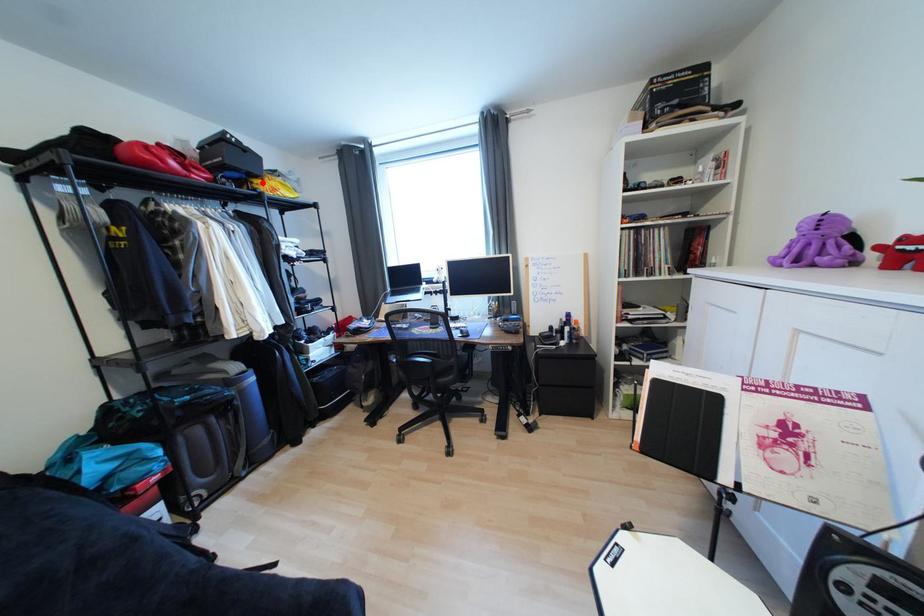
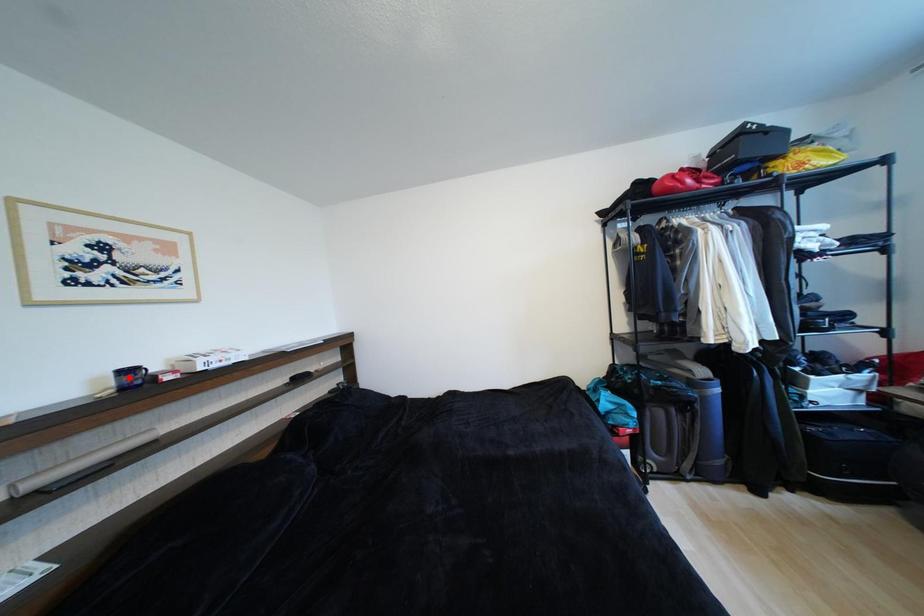
I am providing you with two images of the same scene from different viewpoints. A red point is marked on the first image and another point is marked on the second image. Is the red point in image1 aligned with the point shown in image2?

No